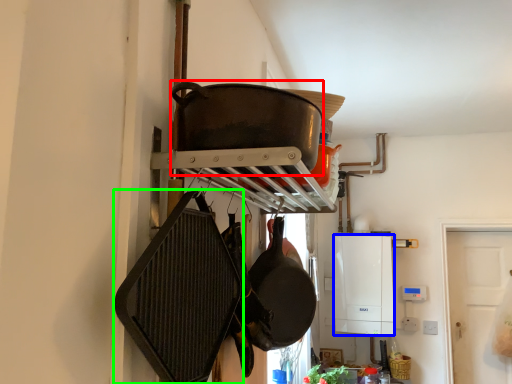
Question: Considering the real-world distances, which object is farthest from wok (highlighted by a red box)? appliance (highlighted by a blue box) or frying pan (highlighted by a green box)?

Choices:
 (A) appliance
 (B) frying pan

Answer: (A)